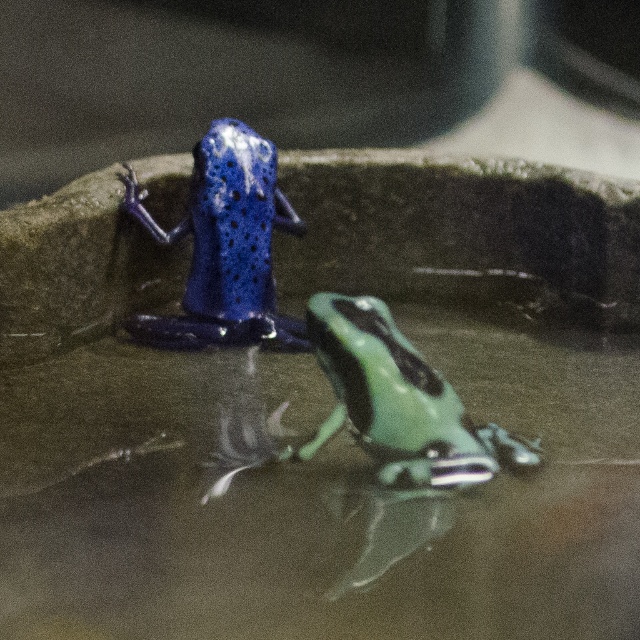
Can you confirm if shiny blue dart frog at upper left is positioned below green matte tree frog at center?

No, shiny blue dart frog at upper left is not below green matte tree frog at center.

Between shiny blue dart frog at upper left and green matte tree frog at center, which one is positioned higher?

shiny blue dart frog at upper left is higher up.

Locate an element on the screen. The height and width of the screenshot is (640, 640). shiny blue dart frog at upper left is located at coordinates (225, 246).